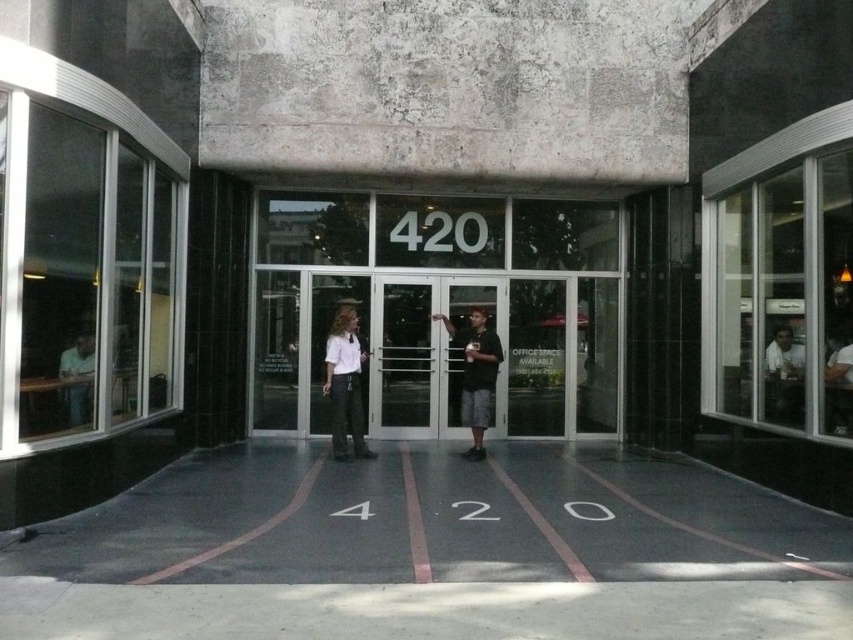
Question: Which of these objects is positioned closest to the white shirt at center?

Choices:
 (A) matte black shirt at left
 (B) white glass doors at center
 (C) black asphalt pavement at center
 (D) transparent glass door at center

Answer: (D)

Question: Based on their relative distances, which object is farther from the white glass doors at center?

Choices:
 (A) matte white shirt at center
 (B) light brown wood chair at right
 (C) matte black shirt at left
 (D) transparent glass door at center

Answer: (C)

Question: Is white glass doors at center to the left of transparent glass door at center from the viewer's perspective?

Choices:
 (A) yes
 (B) no

Answer: (B)

Question: Does black asphalt pavement at center appear under matte black shirt at left?

Choices:
 (A) no
 (B) yes

Answer: (B)

Question: Which point is farther from the camera taking this photo?

Choices:
 (A) (74, 403)
 (B) (332, 348)
 (C) (194, 580)
 (D) (782, 420)

Answer: (B)

Question: Does white glass doors at center have a smaller size compared to matte black shirt at left?

Choices:
 (A) no
 (B) yes

Answer: (A)